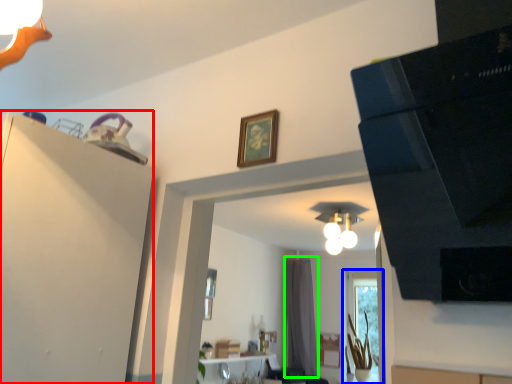
Question: Considering the real-world distances, which object is closest to dresser (highlighted by a red box)? window (highlighted by a blue box) or curtain (highlighted by a green box).

Choices:
 (A) window
 (B) curtain

Answer: (A)